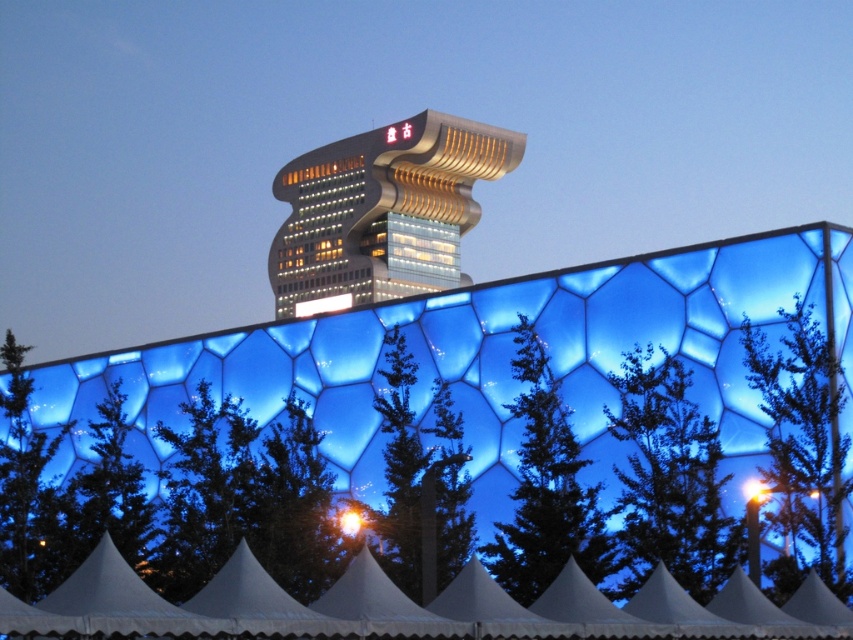
Question: Which of these objects is positioned farthest from the matte gold sign at upper center?

Choices:
 (A) metallic glass tower at upper center
 (B) white fabric tent at lower center

Answer: (B)

Question: Is metallic glass tower at upper center closer to the viewer compared to bright yellow light at upper center?

Choices:
 (A) yes
 (B) no

Answer: (B)

Question: Which of the following is the closest to the observer?

Choices:
 (A) (428, 212)
 (B) (354, 513)
 (C) (376, 627)

Answer: (C)

Question: Among these objects, which one is nearest to the camera?

Choices:
 (A) bright yellow light at lower center
 (B) metallic glass tower at upper center

Answer: (A)

Question: Observing the image, what is the correct spatial positioning of white fabric tent at lower center in reference to bright yellow light at upper center?

Choices:
 (A) right
 (B) left

Answer: (B)

Question: Does metallic glass tower at upper center appear over bright yellow light at lower center?

Choices:
 (A) yes
 (B) no

Answer: (A)